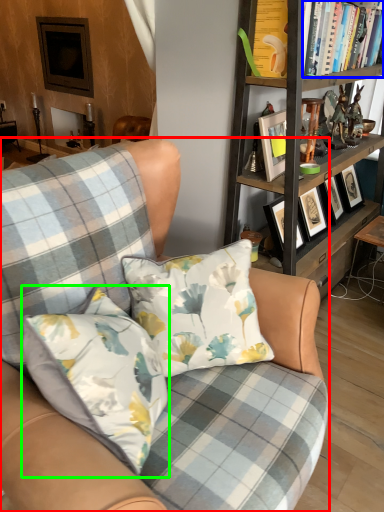
Question: Which is nearer to the chair (highlighted by a red box)? book (highlighted by a blue box) or pillow (highlighted by a green box).

Choices:
 (A) book
 (B) pillow

Answer: (B)